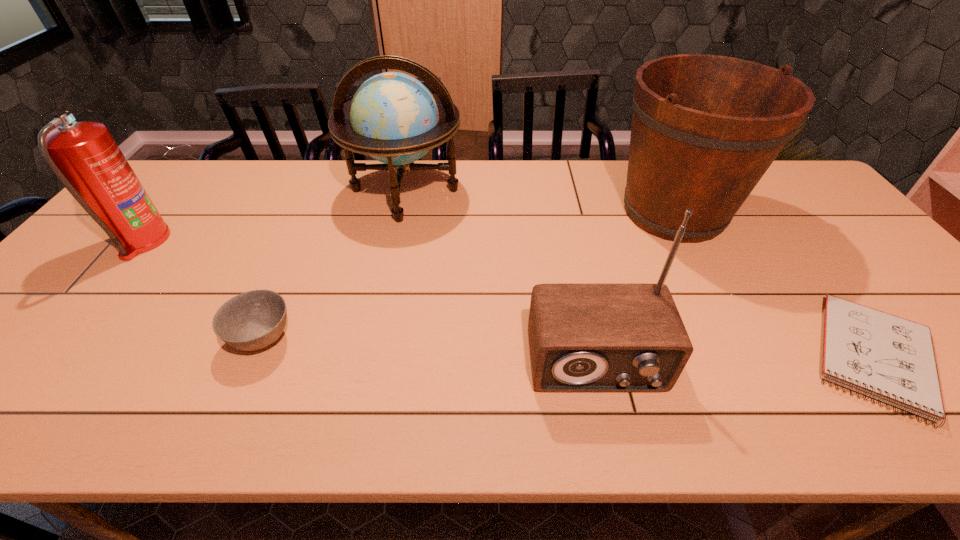
Where is `bucket at the far edge`? Image resolution: width=960 pixels, height=540 pixels. bucket at the far edge is located at coordinates (705, 128).

The image size is (960, 540). I want to click on object located in the near edge section of the desktop, so click(590, 337).

You are a GUI agent. You are given a task and a screenshot of the screen. Output one action in this format:
    pyautogui.click(x=<x>, y=<y>)
    Task: Click on the object located at the left edge
    Image resolution: width=960 pixels, height=540 pixels.
    Given the screenshot: What is the action you would take?
    pyautogui.click(x=85, y=158)

At what (x,y) coordinates should I click in order to perform the action: click on vacant space at the far edge. Please return your answer as a coordinate pair (x, y). This screenshot has height=540, width=960. Looking at the image, I should click on (543, 171).

In the image, there is a desktop. Where is `free space at the near edge`? free space at the near edge is located at coordinates [524, 417].

Locate an element on the screen. This screenshot has width=960, height=540. vacant area at the right edge of the desktop is located at coordinates [x=924, y=314].

At what (x,y) coordinates should I click in order to perform the action: click on vacant space at the far left corner of the desktop. Please return your answer as a coordinate pair (x, y). Looking at the image, I should click on 167,167.

This screenshot has width=960, height=540. Find the location of `vacant area that lies between the second shortest object and the bucket`. vacant area that lies between the second shortest object and the bucket is located at coordinates (468, 275).

Find the location of a particular element. The width and height of the screenshot is (960, 540). unoccupied area between the fire extinguisher and the bucket is located at coordinates (408, 227).

Locate an element on the screen. The image size is (960, 540). free space between the fire extinguisher and the bucket is located at coordinates (408, 227).